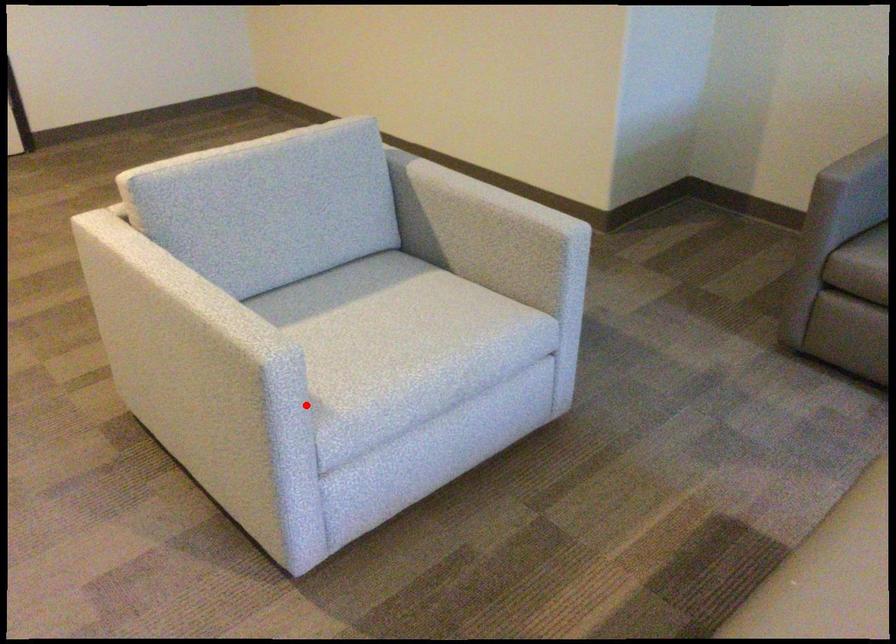
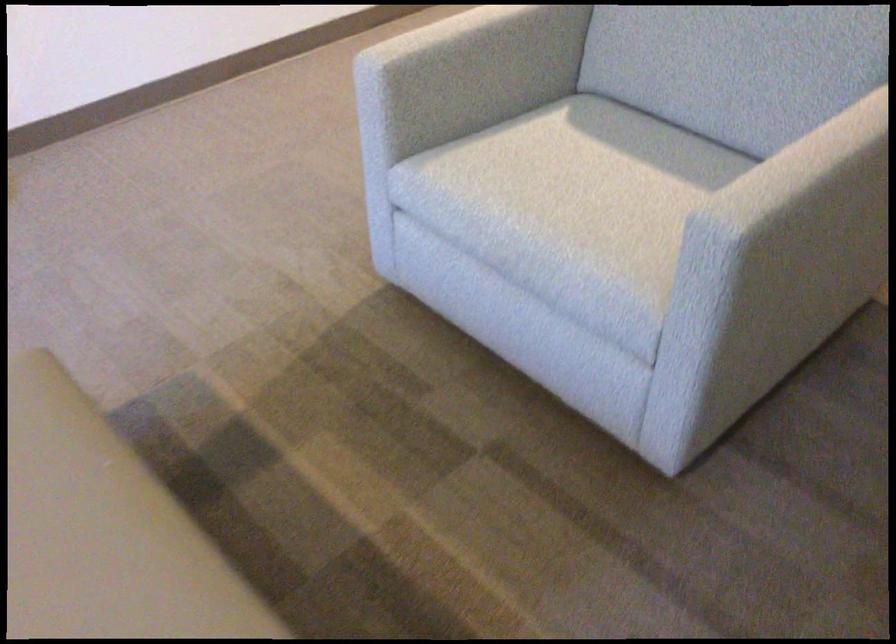
Question: I am providing you with two images of the same scene from different viewpoints. A red point is marked on the first image. Can you still see the location of the red point in image 2?

Choices:
 (A) Yes
 (B) No

Answer: (A)